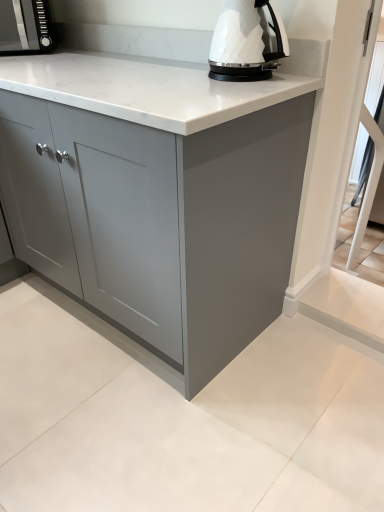
Image resolution: width=384 pixels, height=512 pixels. Describe the element at coordinates (170, 194) in the screenshot. I see `matte gray cabinet at center` at that location.

What are the coordinates of `matte black microwave at upper left` in the screenshot? It's located at (25, 26).

Is white glossy electric kettle at upper center wider than matte gray cabinet at center?

Incorrect, the width of white glossy electric kettle at upper center does not surpass that of matte gray cabinet at center.

Does white glossy electric kettle at upper center appear on the right side of matte gray cabinet at center?

Correct, you'll find white glossy electric kettle at upper center to the right of matte gray cabinet at center.

From the image's perspective, is white glossy electric kettle at upper center below matte gray cabinet at center?

Actually, white glossy electric kettle at upper center appears above matte gray cabinet at center in the image.

Is white glossy electric kettle at upper center not near matte gray cabinet at center?

That's not correct — white glossy electric kettle at upper center is a little close to matte gray cabinet at center.

Which is behind, point (46, 27) or point (231, 48)?

The point (46, 27) is more distant.

Considering the sizes of objects matte black microwave at upper left and white glossy electric kettle at upper center in the image provided, who is bigger, matte black microwave at upper left or white glossy electric kettle at upper center?

matte black microwave at upper left is bigger.

Which object is positioned more to the left, matte black microwave at upper left or white glossy electric kettle at upper center?

matte black microwave at upper left is more to the left.

Is matte black microwave at upper left outside of white glossy electric kettle at upper center?

Absolutely, matte black microwave at upper left is external to white glossy electric kettle at upper center.

Looking at the image, does matte black microwave at upper left seem bigger or smaller compared to matte gray cabinet at center?

Considering their sizes, matte black microwave at upper left takes up less space than matte gray cabinet at center.

Is matte black microwave at upper left taller or shorter than matte gray cabinet at center?

Considering their sizes, matte black microwave at upper left has less height than matte gray cabinet at center.

At what (x,y) coordinates should I click in order to perform the action: click on kitchen appliance above the matte gray cabinet at center (from the image's perspective). Please return your answer as a coordinate pair (x, y). Looking at the image, I should click on (25, 26).

From a real-world perspective, relative to white glossy electric kettle at upper center, is matte gray cabinet at center vertically above or below?

matte gray cabinet at center is situated lower than white glossy electric kettle at upper center in the real world.

Choose the correct answer: Is matte gray cabinet at center inside white glossy electric kettle at upper center or outside it?

matte gray cabinet at center cannot be found inside white glossy electric kettle at upper center.

Between point (118, 91) and point (251, 46), which one is positioned behind?

Point (251, 46)

Is matte gray cabinet at center taller than matte black microwave at upper left?

Correct, matte gray cabinet at center is much taller as matte black microwave at upper left.

Which is more to the left, matte gray cabinet at center or matte black microwave at upper left?

matte black microwave at upper left is more to the left.

In terms of width, does matte gray cabinet at center look wider or thinner when compared to matte black microwave at upper left?

In the image, matte gray cabinet at center appears to be wider than matte black microwave at upper left.

Which is further, [113,213] or [47,5]?

The point [47,5] is more distant.

From the image's perspective, would you say white glossy electric kettle at upper center is positioned over matte black microwave at upper left?

No, from the image's perspective, white glossy electric kettle at upper center is not on top of matte black microwave at upper left.

Is white glossy electric kettle at upper center not near matte black microwave at upper left?

No, white glossy electric kettle at upper center is in close proximity to matte black microwave at upper left.

Which is behind, point (225, 17) or point (36, 7)?

Positioned behind is point (36, 7).

Image resolution: width=384 pixels, height=512 pixels. Find the location of `cabinetry located on the left of white glossy electric kettle at upper center`. cabinetry located on the left of white glossy electric kettle at upper center is located at coordinates (170, 194).

This screenshot has width=384, height=512. I want to click on home appliance that appears below the matte black microwave at upper left (from the image's perspective), so click(x=246, y=42).

Which object lies nearer to the anchor point matte black microwave at upper left, white glossy electric kettle at upper center or matte gray cabinet at center?

Based on the image, white glossy electric kettle at upper center appears to be nearer to matte black microwave at upper left.

Considering their positions, is matte gray cabinet at center positioned further to matte black microwave at upper left than white glossy electric kettle at upper center?

matte gray cabinet at center is positioned further to the anchor matte black microwave at upper left.

Looking at the image, which one is located further to white glossy electric kettle at upper center, matte gray cabinet at center or matte black microwave at upper left?

matte black microwave at upper left is positioned further to the anchor white glossy electric kettle at upper center.

Considering their positions, is matte black microwave at upper left positioned closer to white glossy electric kettle at upper center than matte gray cabinet at center?

matte gray cabinet at center.

Considering their positions, is matte black microwave at upper left positioned closer to matte gray cabinet at center than white glossy electric kettle at upper center?

white glossy electric kettle at upper center is positioned closer to the anchor matte gray cabinet at center.

Considering their positions, is white glossy electric kettle at upper center positioned closer to matte gray cabinet at center than matte black microwave at upper left?

white glossy electric kettle at upper center.

Identify the location of cabinetry between matte black microwave at upper left and white glossy electric kettle at upper center. The width and height of the screenshot is (384, 512). pos(170,194).